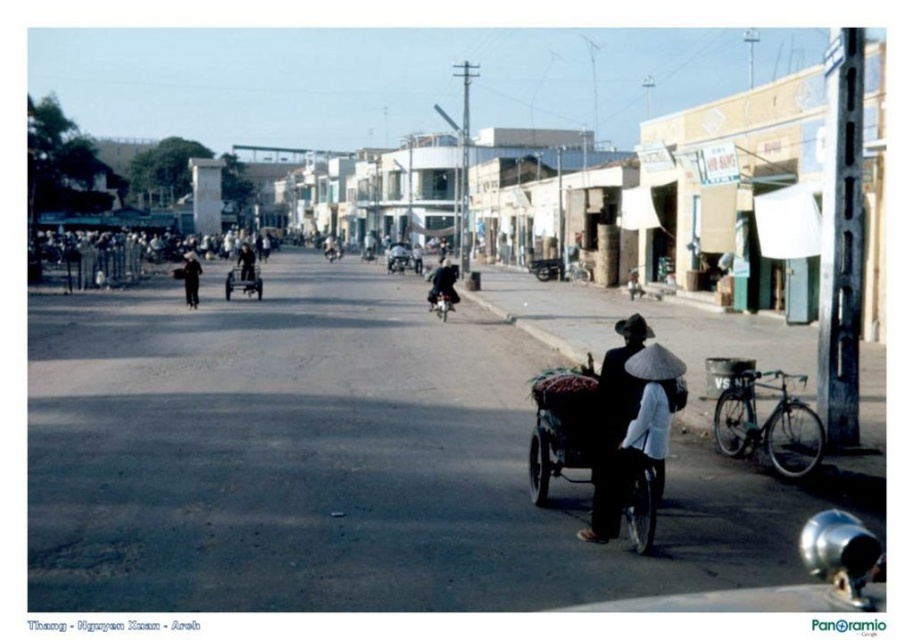
Question: Does matte black tricycle at center appear under black matte conical hat at center?

Choices:
 (A) yes
 (B) no

Answer: (B)

Question: Which point is farther from the camera taking this photo?

Choices:
 (A) (234, 273)
 (B) (192, 257)
 (C) (453, 284)

Answer: (A)

Question: Can you confirm if metallic silver rickshaw at center is wider than black matte person at center?

Choices:
 (A) yes
 (B) no

Answer: (B)

Question: Can you confirm if dark blue fabric at center is thinner than black matte person at center?

Choices:
 (A) no
 (B) yes

Answer: (B)

Question: Which point is closer to the camera taking this photo?

Choices:
 (A) (611, 394)
 (B) (253, 284)

Answer: (A)

Question: Among these points, which one is farthest from the camera?

Choices:
 (A) (225, 285)
 (B) (186, 273)
 (C) (243, 246)

Answer: (C)